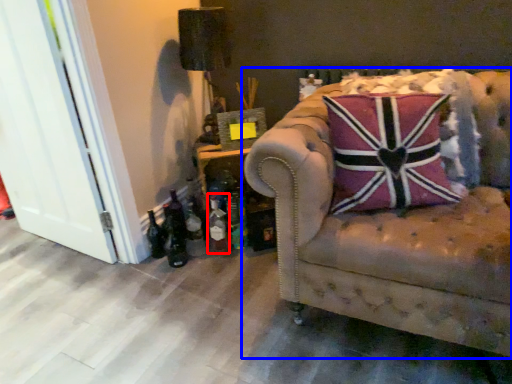
Question: Among these objects, which one is nearest to the camera, bottle (highlighted by a red box) or studio couch (highlighted by a blue box)?

Choices:
 (A) bottle
 (B) studio couch

Answer: (B)